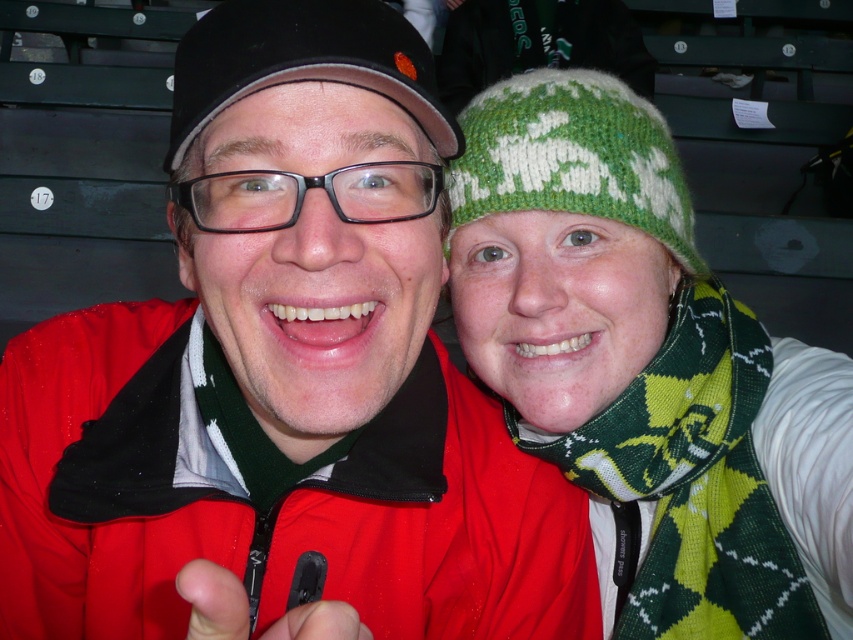
You are trying to locate two people in a stadium scene. The scene has a matte black jacket at center and a green knitted hat at upper right. Which object is positioned lower in the image?

The matte black jacket at center is located below the green knitted hat at upper right, so the matte black jacket at center is positioned lower in the image.

You are designing a poster for a sports event and need to ensure the two objects in the image are clearly visible. Given that the matte black jacket at center and the black matte cap at upper center are both dark in color, which object should you highlight first to ensure visibility?

The matte black jacket at center should be highlighted first because it is taller than the black matte cap at upper center, making it more prominent in the image.

You are sitting on the bleachers and want to hand a snack to the person wearing the green knitted hat at upper right. Which direction should you move to reach them from the matte black jacket at center?

The matte black jacket at center is to the left of the green knitted hat at upper right, so you should move to the right to reach them.